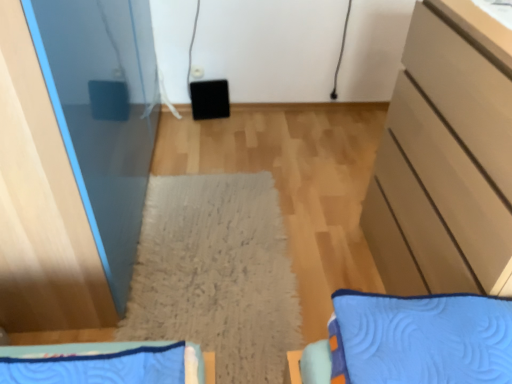
Question: From a real-world perspective, is matte beige cabinet at right on top of beige textured mat at center?

Choices:
 (A) yes
 (B) no

Answer: (A)

Question: From the image's perspective, is matte beige cabinet at right below beige textured mat at center?

Choices:
 (A) yes
 (B) no

Answer: (B)

Question: Would you say matte beige cabinet at right is a long distance from beige textured mat at center?

Choices:
 (A) no
 (B) yes

Answer: (A)

Question: Is matte beige cabinet at right smaller than beige textured mat at center?

Choices:
 (A) yes
 (B) no

Answer: (B)

Question: Can you confirm if matte beige cabinet at right is positioned to the right of beige textured mat at center?

Choices:
 (A) no
 (B) yes

Answer: (B)

Question: Is matte beige cabinet at right at the left side of beige textured mat at center?

Choices:
 (A) no
 (B) yes

Answer: (A)

Question: Does beige textured mat at center appear on the left side of matte beige cabinet at right?

Choices:
 (A) no
 (B) yes

Answer: (B)

Question: Does beige textured mat at center have a smaller size compared to matte beige cabinet at right?

Choices:
 (A) no
 (B) yes

Answer: (B)

Question: Does beige textured mat at center touch matte beige cabinet at right?

Choices:
 (A) yes
 (B) no

Answer: (B)

Question: Can you confirm if beige textured mat at center is bigger than matte beige cabinet at right?

Choices:
 (A) yes
 (B) no

Answer: (B)

Question: From the image's perspective, is beige textured mat at center on top of matte beige cabinet at right?

Choices:
 (A) yes
 (B) no

Answer: (B)

Question: From a real-world perspective, is beige textured mat at center beneath matte beige cabinet at right?

Choices:
 (A) yes
 (B) no

Answer: (A)

Question: Can blue quilted bedspread at lower left be found inside matte beige cabinet at right?

Choices:
 (A) no
 (B) yes

Answer: (A)